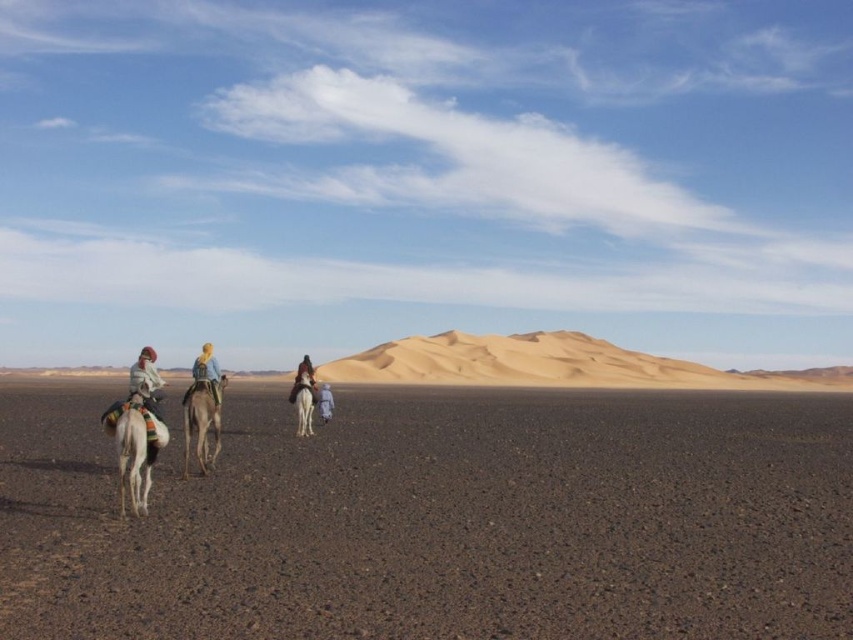
Question: Is light brown textured camel at center below white fabric headscarf at center?

Choices:
 (A) yes
 (B) no

Answer: (B)

Question: Which point appears farthest from the camera in this image?

Choices:
 (A) (302, 419)
 (B) (135, 412)
 (C) (328, 385)
 (D) (148, 376)

Answer: (C)

Question: Is white matte camel at center bigger than dark brown leather saddle at center?

Choices:
 (A) yes
 (B) no

Answer: (B)

Question: Estimate the real-world distances between objects in this image. Which object is closer to the white fabric headscarf at center?

Choices:
 (A) brown sandy dirt at lower center
 (B) white woolen blanket at left
 (C) white matte camel at left

Answer: (A)

Question: Which object is farther from the camera taking this photo?

Choices:
 (A) dark brown leather saddle at center
 (B) light brown textured camel at center
 (C) white fabric headscarf at center
 (D) white matte camel at left

Answer: (C)

Question: Does brown sandy dirt at lower center appear on the right side of dark brown leather saddle at center?

Choices:
 (A) no
 (B) yes

Answer: (B)